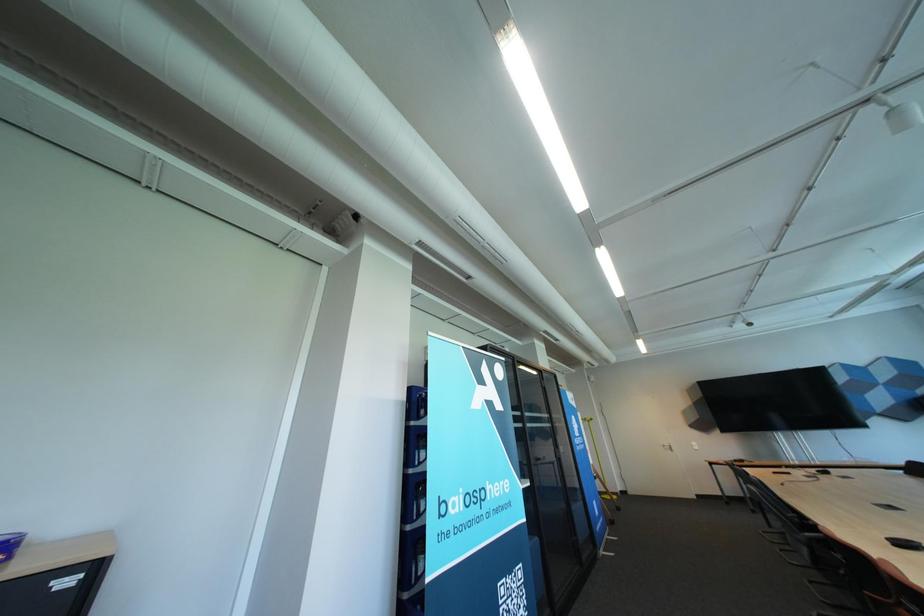
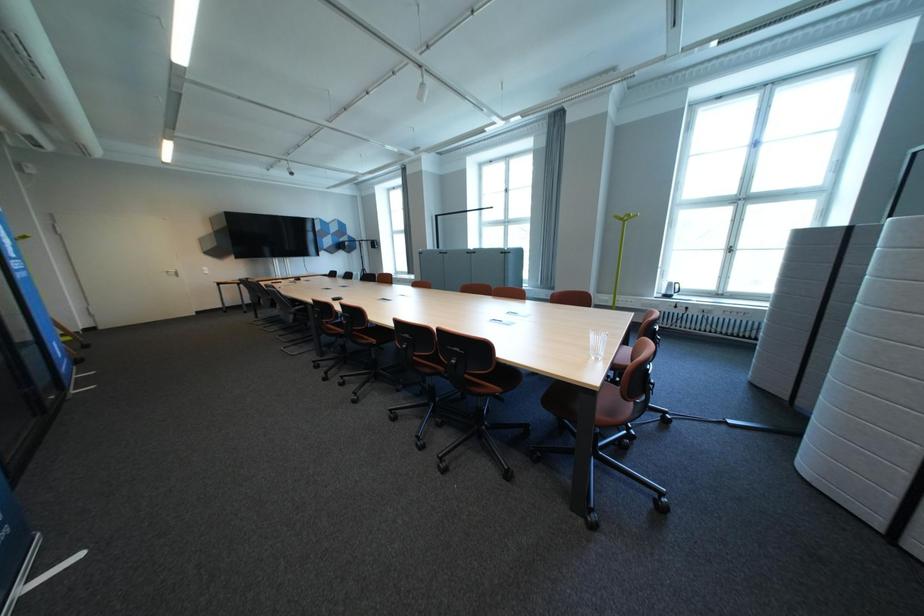
Question: Based on the continuous images, in which direction is the camera rotating? Reply with the corresponding letter.

Choices:
 (A) Left
 (B) Right
 (C) Up
 (D) Down

Answer: (B)